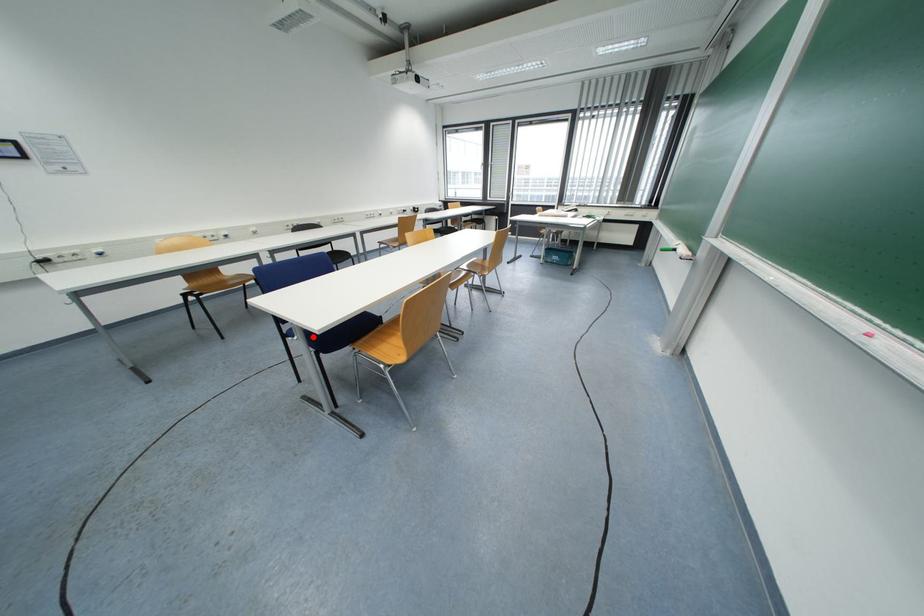
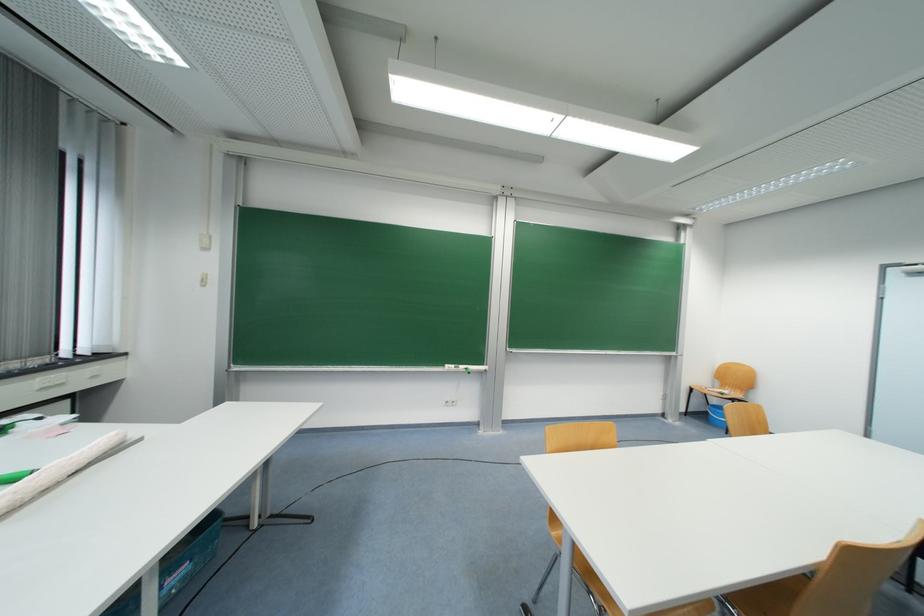
Question: I am providing you with two images of the same scene from different viewpoints. A red point is marked on the first image. Is the red point's position out of view in image 2?

Choices:
 (A) Yes
 (B) No

Answer: (A)